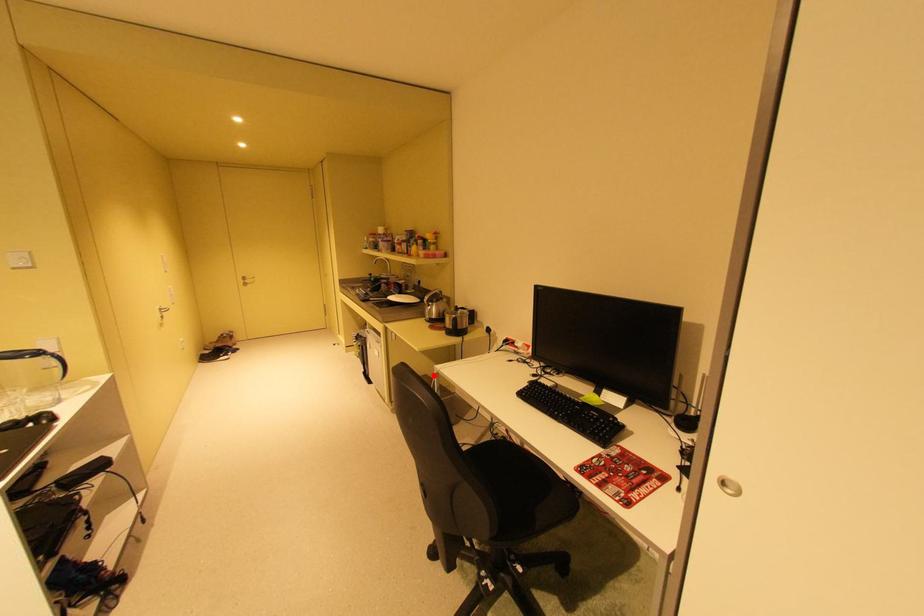
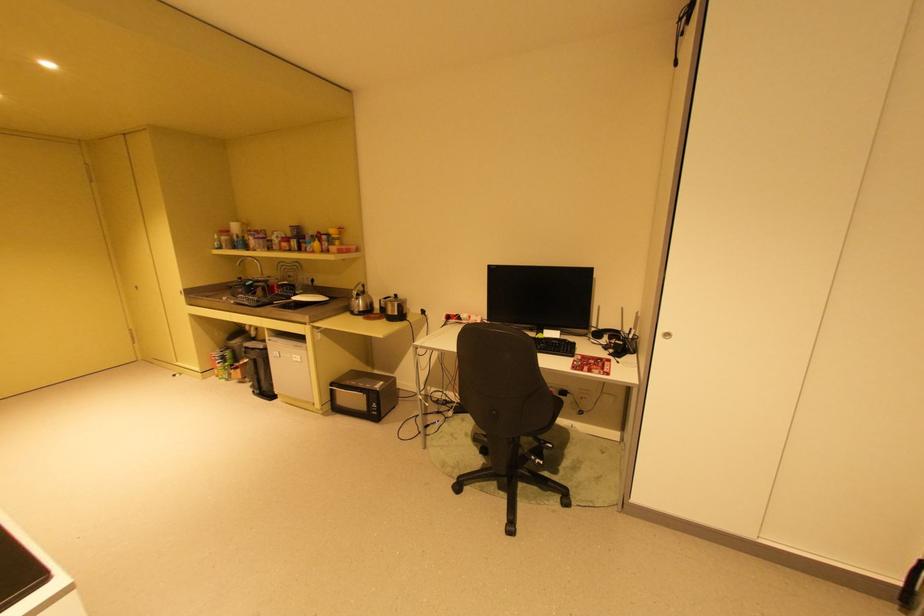
Locate, in the second image, the point that corresponds to the highlighted location in the first image.

(359, 371)